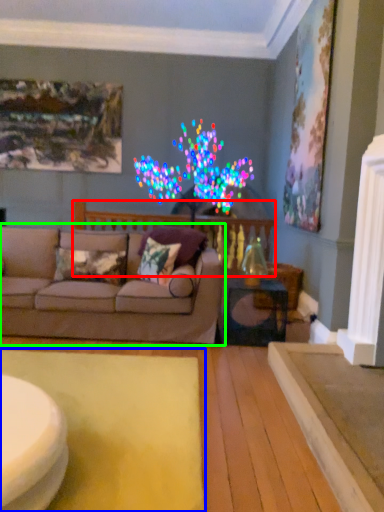
Question: Considering the real-world distances, which object is closest to balustrade (highlighted by a red box)? mat (highlighted by a blue box) or studio couch (highlighted by a green box).

Choices:
 (A) mat
 (B) studio couch

Answer: (B)